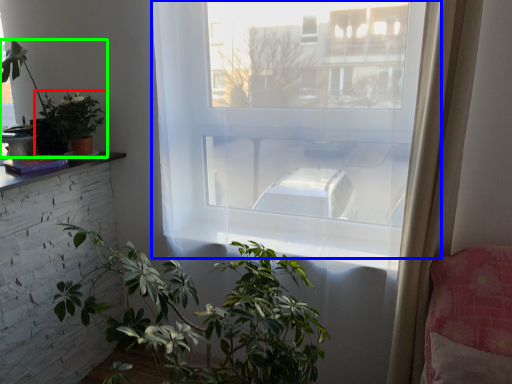
Question: Estimate the real-world distances between objects in this image. Which object is closer to houseplant (highlighted by a red box), window (highlighted by a blue box) or houseplant (highlighted by a green box)?

Choices:
 (A) window
 (B) houseplant

Answer: (B)